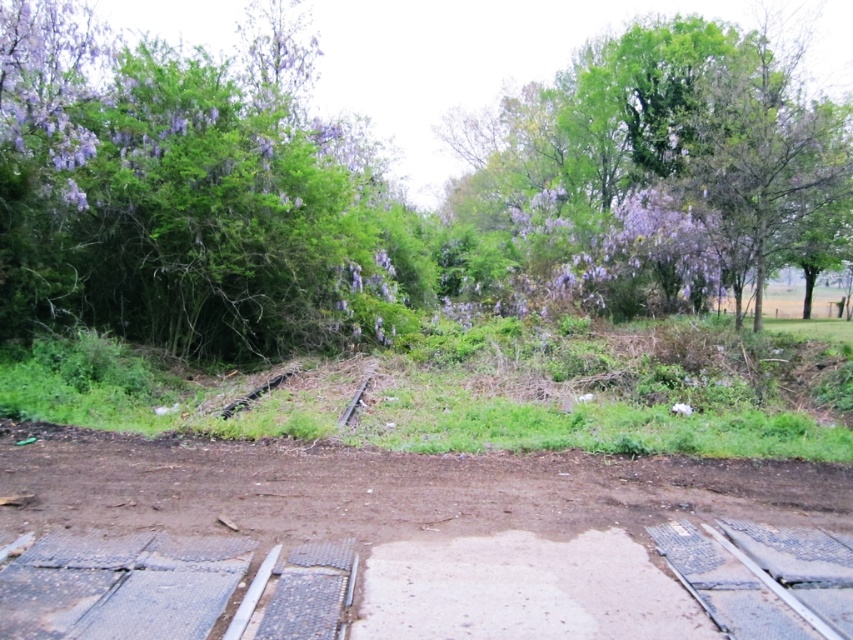
You are standing at the point marked as point (412, 545). What is the terrain like under your feet?

The terrain under your feet at point (412, 545) is a brown dirt track at center.

You are a gardener looking at the scene. You notice two purple leafy plants at the upper left corner. Which one is closer to you, the purple leafy bush at upper left or the purple leafy tree at upper left?

The purple leafy bush at upper left is closer to you because it is in front of the purple leafy tree at upper left.

You are a delivery drone that needs to land on the brown dirt track at center. What are the coordinates of the landing spot?

The coordinates of the brown dirt track at center are at point (412, 545).